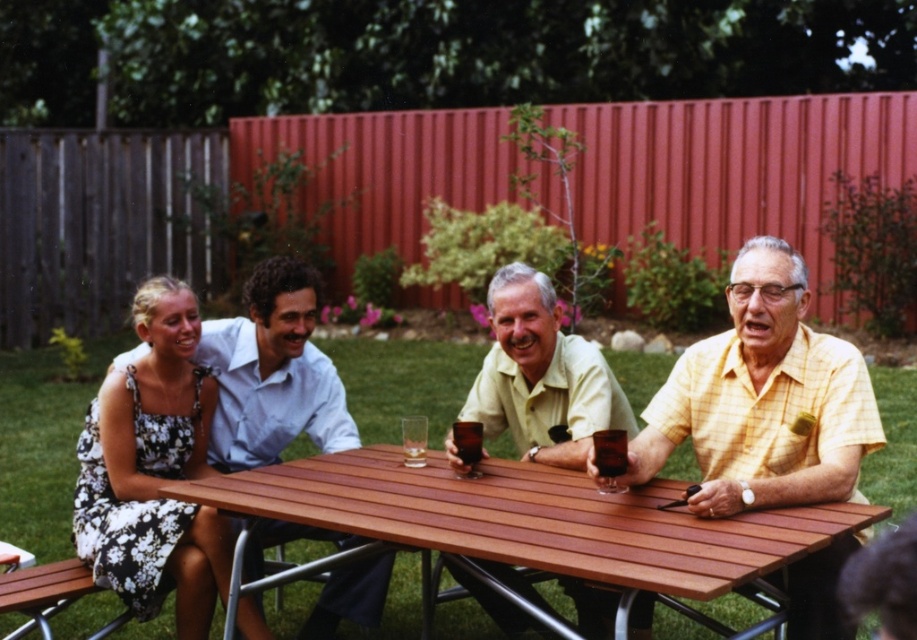
Who is positioned more to the left, translucent amber liquid at table center or brown glass at table center?

From the viewer's perspective, brown glass at table center appears more on the left side.

Consider the image. Does translucent amber liquid at table center appear on the right side of brown glass at table center?

Yes, translucent amber liquid at table center is to the right of brown glass at table center.

Which is in front, point (608, 444) or point (459, 445)?

Positioned in front is point (608, 444).

You are a GUI agent. You are given a task and a screenshot of the screen. Output one action in this format:
    pyautogui.click(x=<x>, y=<y>)
    Task: Click on the translucent amber liquid at table center
    The width and height of the screenshot is (917, 640).
    Given the screenshot: What is the action you would take?
    pyautogui.click(x=609, y=452)

Can you confirm if yellow checkered shirt at right is smaller than brown glass at table center?

Actually, yellow checkered shirt at right might be larger than brown glass at table center.

Who is positioned more to the right, yellow checkered shirt at right or brown glass at table center?

Positioned to the right is yellow checkered shirt at right.

Where is `yellow checkered shirt at right`? The image size is (917, 640). yellow checkered shirt at right is located at coordinates (763, 400).

Locate an element on the screen. This screenshot has height=640, width=917. yellow checkered shirt at right is located at coordinates click(x=763, y=400).

From the picture: Can you confirm if matte blue shirt at left is positioned to the right of brown glass at table center?

In fact, matte blue shirt at left is to the left of brown glass at table center.

Measure the distance between matte blue shirt at left and brown glass at table center.

They are 87.58 centimeters apart.

Locate an element on the screen. The width and height of the screenshot is (917, 640). matte blue shirt at left is located at coordinates (272, 371).